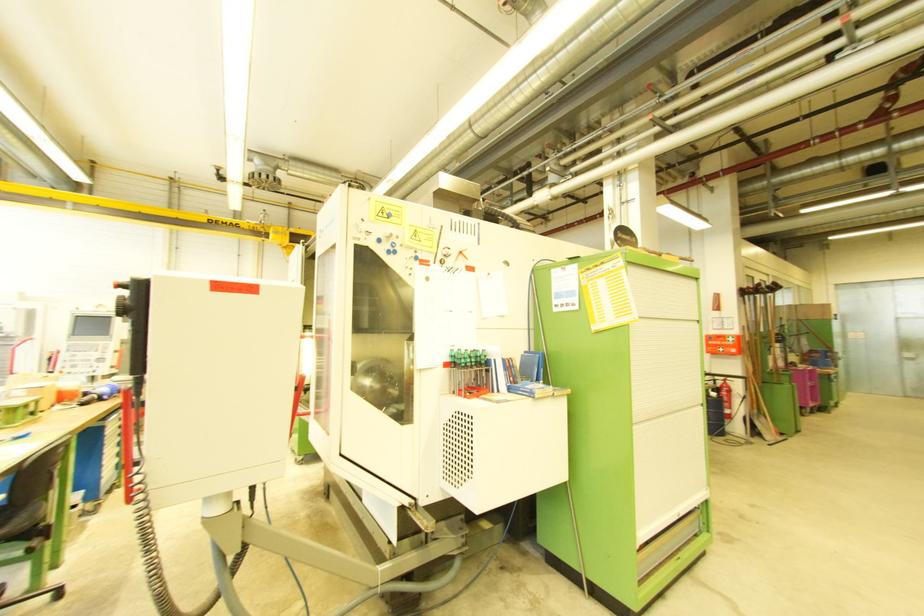
Find the location of a particular element. fire extinguisher handle is located at coordinates (725, 399).